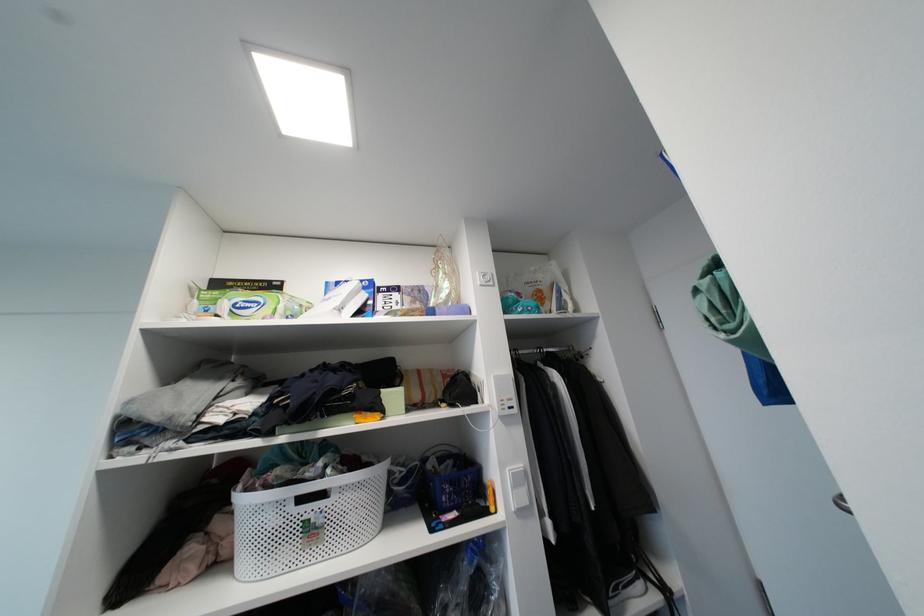
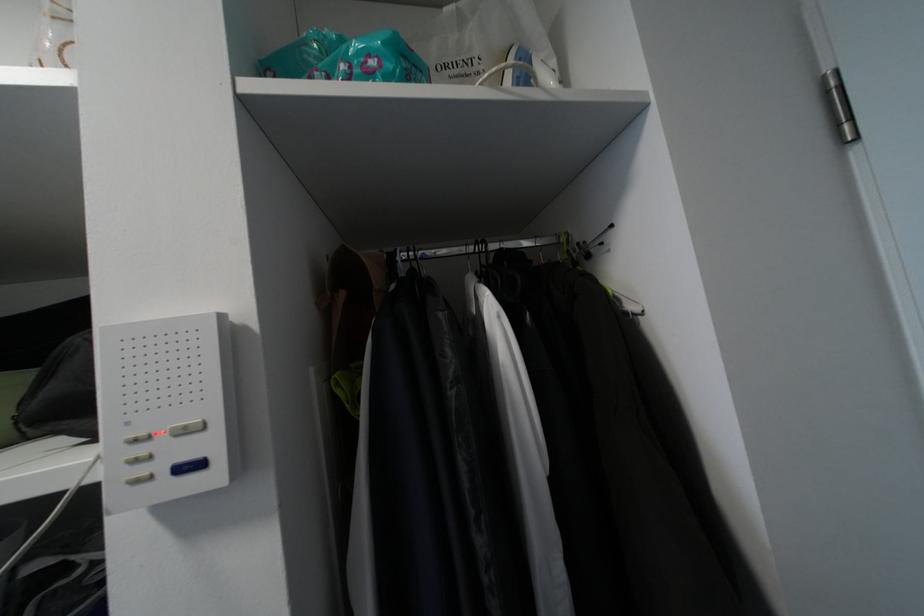
In the second image, find the point that corresponds to point (533, 309) in the first image.

(377, 63)